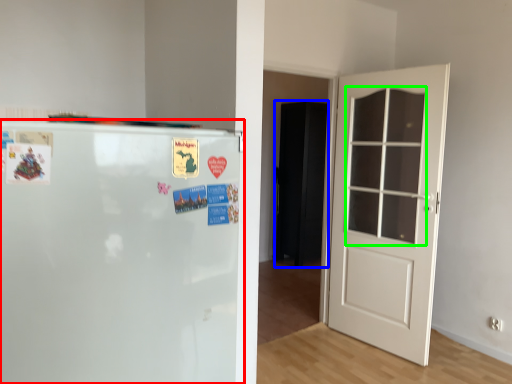
Question: Based on their relative distances, which object is farther from refrigerator (highlighted by a red box)? Choose from armoire (highlighted by a blue box) and window (highlighted by a green box).

Choices:
 (A) armoire
 (B) window

Answer: (A)